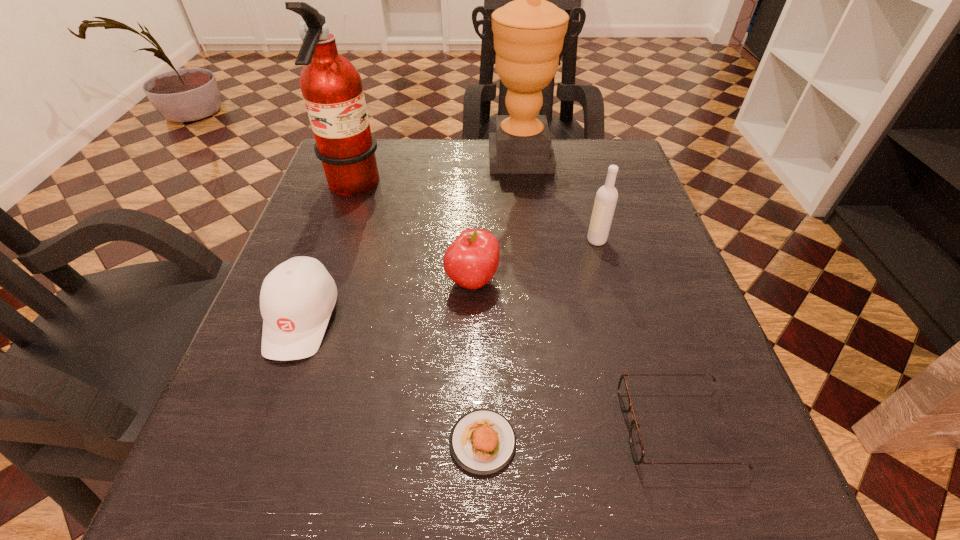
Where is `blank space that satisfies the following two spatial constraints: 1. at the front of the award with handles; 2. on the nozzle and handle of the fire extinguisher`? The image size is (960, 540). blank space that satisfies the following two spatial constraints: 1. at the front of the award with handles; 2. on the nozzle and handle of the fire extinguisher is located at coordinates pos(522,188).